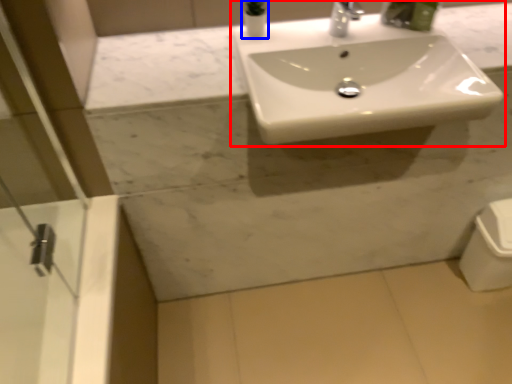
Question: Which object is further to the camera taking this photo, sink (highlighted by a red box) or toiletry (highlighted by a blue box)?

Choices:
 (A) sink
 (B) toiletry

Answer: (B)